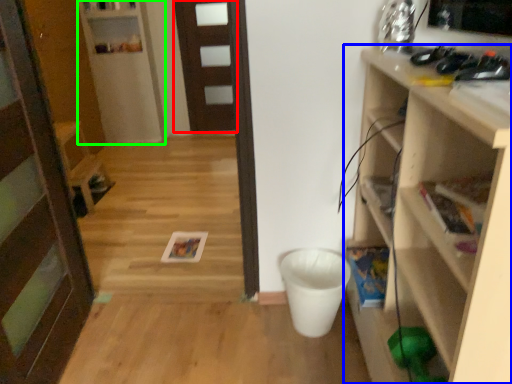
Question: Based on their relative distances, which object is nearer to door (highlighted by a red box)? Choose from shelf (highlighted by a blue box) and shelf (highlighted by a green box).

Choices:
 (A) shelf
 (B) shelf

Answer: (B)